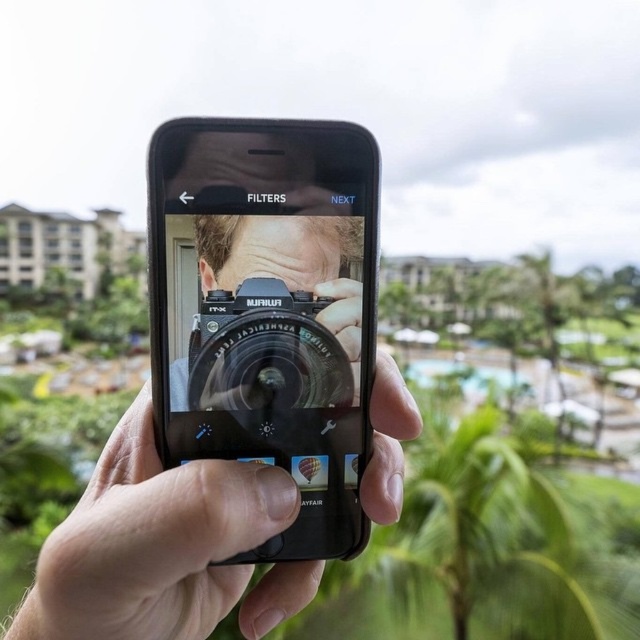
Is black matte smartphone at center positioned in front of matte black phone at center?

No, it is behind matte black phone at center.

Identify the location of black matte smartphone at center. (268, 310).

Is point (346, 557) more distant than point (140, 394)?

No, it is not.

Where is `black matte smartphone at center`? Image resolution: width=640 pixels, height=640 pixels. black matte smartphone at center is located at coordinates (268, 310).